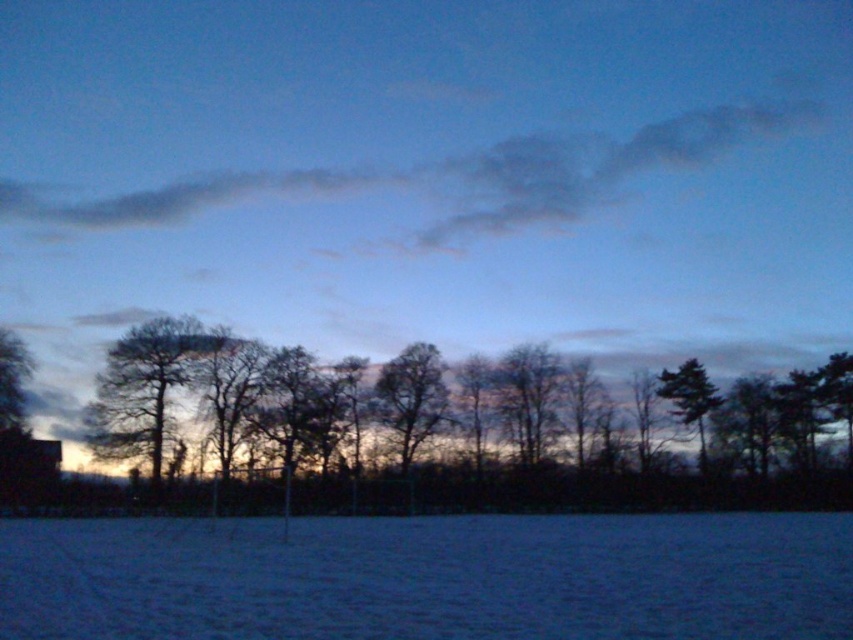
You are an artist painting this winter scene. You want to ensure the green matte tree at right is visible in your painting. Should you place it in front of or behind the dark gray cloud at upper center?

The green matte tree at right is behind the dark gray cloud at upper center, so to make it visible, you should paint it in front of the dark gray cloud at upper center.

You are standing in the winter scene and want to walk from the starting point to the endpoint. The starting point is at point (219, 396), and the endpoint is at point (198, 337). Since you can only move forward, will you be able to see the endpoint from your starting position?

Point (219, 396) is in front of point (198, 337), so yes, you can see the endpoint from your starting position because it is directly ahead of you.